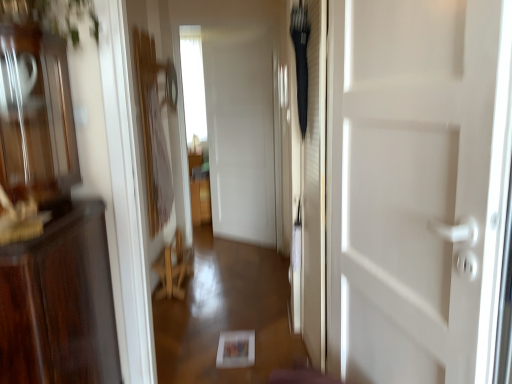
Question: Should I look upward or downward to see white glossy door at center?

Choices:
 (A) down
 (B) up

Answer: (A)

Question: Is white glossy door at center taller than wooden chair at center?

Choices:
 (A) no
 (B) yes

Answer: (B)

Question: Is the depth of white glossy door at center greater than that of wooden chair at center?

Choices:
 (A) no
 (B) yes

Answer: (A)

Question: Is white glossy door at center positioned beyond the bounds of wooden chair at center?

Choices:
 (A) yes
 (B) no

Answer: (A)

Question: Is white glossy door at center smaller than wooden chair at center?

Choices:
 (A) no
 (B) yes

Answer: (A)

Question: Is white glossy door at center to the left of wooden chair at center from the viewer's perspective?

Choices:
 (A) yes
 (B) no

Answer: (B)

Question: Does white glossy door at center have a greater width compared to wooden chair at center?

Choices:
 (A) yes
 (B) no

Answer: (B)

Question: Considering the relative sizes of transparent glass window at center and wooden chair at center in the image provided, is transparent glass window at center wider than wooden chair at center?

Choices:
 (A) no
 (B) yes

Answer: (B)

Question: Is transparent glass window at center facing towards wooden chair at center?

Choices:
 (A) yes
 (B) no

Answer: (A)

Question: Is transparent glass window at center beside wooden chair at center?

Choices:
 (A) no
 (B) yes

Answer: (A)

Question: Is transparent glass window at center to the left of wooden chair at center from the viewer's perspective?

Choices:
 (A) yes
 (B) no

Answer: (A)

Question: Is wooden chair at center surrounded by transparent glass window at center?

Choices:
 (A) yes
 (B) no

Answer: (B)

Question: Considering the relative sizes of transparent glass window at center and wooden chair at center in the image provided, is transparent glass window at center shorter than wooden chair at center?

Choices:
 (A) yes
 (B) no

Answer: (B)

Question: Is the surface of transparent glass window at center in direct contact with white glossy door at center?

Choices:
 (A) no
 (B) yes

Answer: (A)